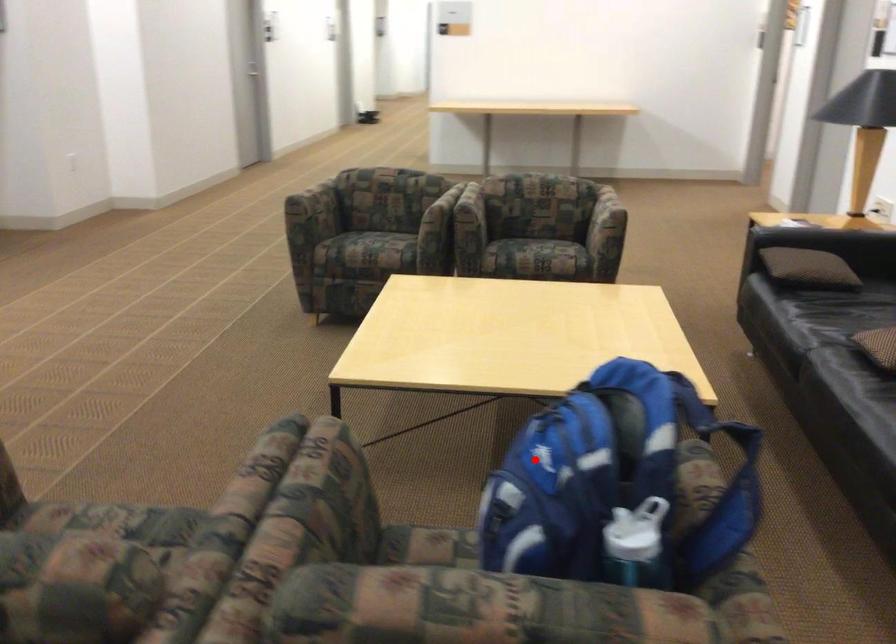
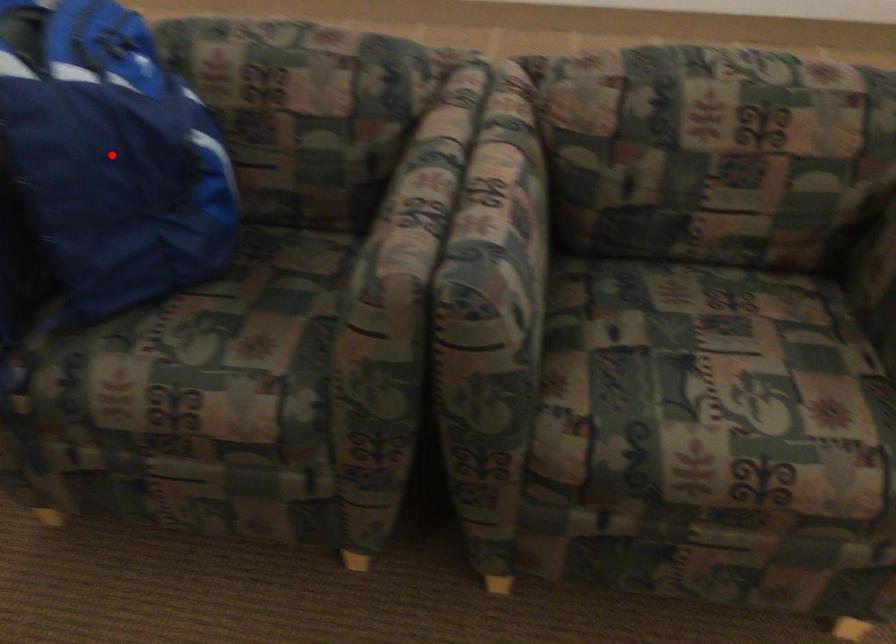
I am providing you with two images of the same scene from different viewpoints. A red point is marked on the first image and another point is marked on the second image. Are the points marked in image1 and image2 representing the same 3D position?

Yes